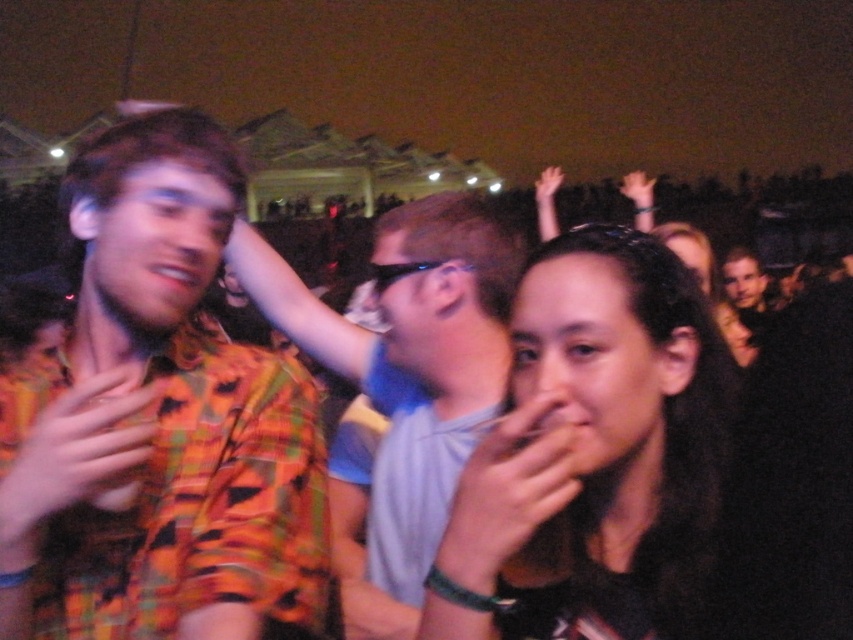
Does plaid shirt at left have a smaller size compared to orange plaid shirt at center?

No, plaid shirt at left is not smaller than orange plaid shirt at center.

Is plaid shirt at left taller than orange plaid shirt at center?

Yes, plaid shirt at left is taller than orange plaid shirt at center.

The height and width of the screenshot is (640, 853). In order to click on plaid shirt at left in this screenshot , I will do `click(408, 305)`.

Is plaid shirt at center shorter than smooth skin hand at center?

Incorrect, plaid shirt at center's height does not fall short of smooth skin hand at center's.

What do you see at coordinates (158, 422) in the screenshot? I see `plaid shirt at center` at bounding box center [158, 422].

Is point (165, 314) closer to camera compared to point (512, 554)?

No.

The image size is (853, 640). Identify the location of plaid shirt at center. (158, 422).

Consider the image. Does black matte hair at center have a lesser height compared to smooth skin hand at center?

No, black matte hair at center is not shorter than smooth skin hand at center.

Where is `black matte hair at center`? This screenshot has height=640, width=853. black matte hair at center is located at coordinates (593, 445).